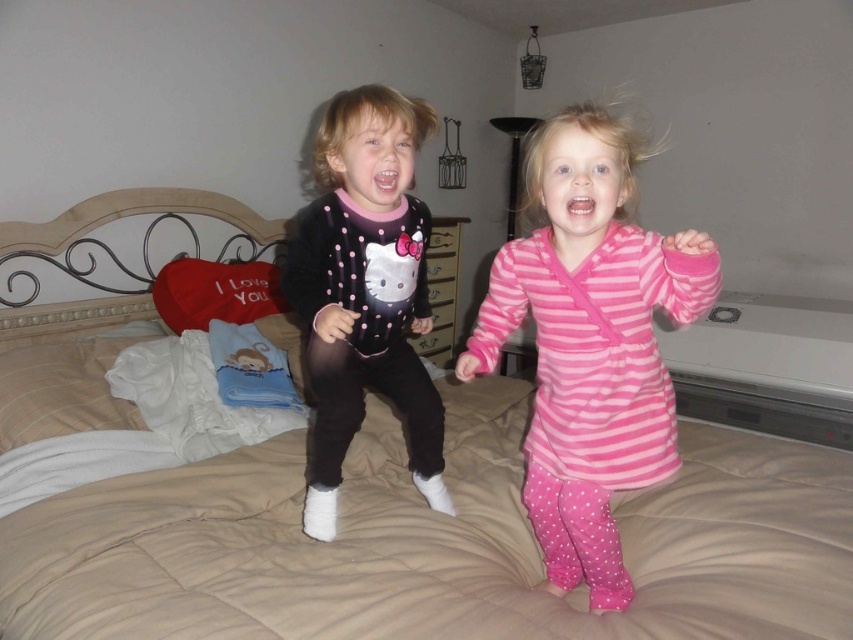
Question: In this image, where is pink striped dress at center located relative to matte black hello kitty onesie at center?

Choices:
 (A) left
 (B) right

Answer: (B)

Question: Based on their relative distances, which object is nearer to the beige quilted bed at center?

Choices:
 (A) matte black hello kitty onesie at center
 (B) pink striped dress at center

Answer: (A)

Question: Does pink striped dress at center appear on the left side of matte black hello kitty onesie at center?

Choices:
 (A) yes
 (B) no

Answer: (B)

Question: Considering the real-world distances, which object is farthest from the matte black hello kitty onesie at center?

Choices:
 (A) pink striped dress at center
 (B) beige quilted bed at center

Answer: (B)

Question: Which is farther from the pink striped dress at center?

Choices:
 (A) beige quilted bed at center
 (B) matte black hello kitty onesie at center

Answer: (A)

Question: Considering the relative positions of pink striped dress at center and matte black hello kitty onesie at center in the image provided, where is pink striped dress at center located with respect to matte black hello kitty onesie at center?

Choices:
 (A) right
 (B) left

Answer: (A)